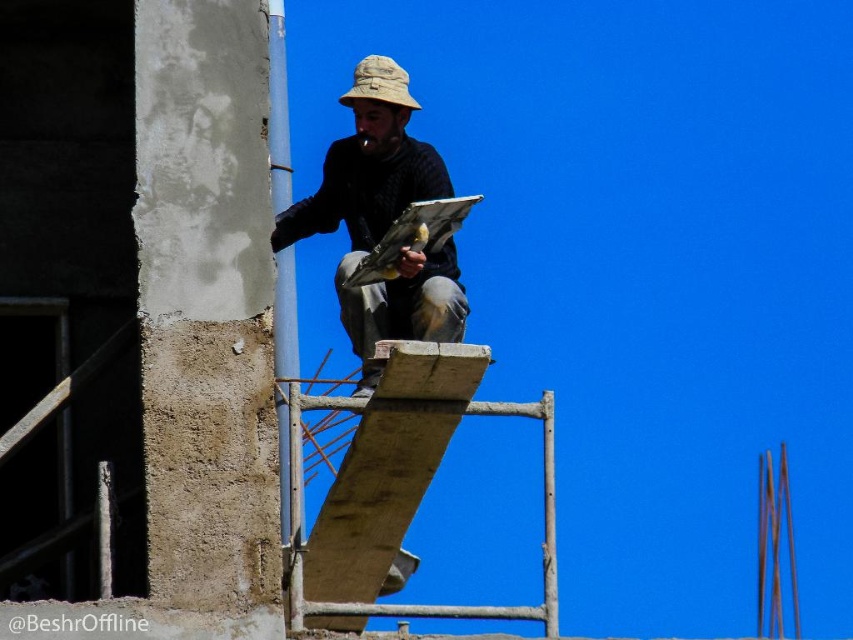
Question: In this image, where is matte black shirt at center located relative to tan fabric hat at center?

Choices:
 (A) above
 (B) below

Answer: (B)

Question: Which of the following is the closest to the observer?

Choices:
 (A) (357, 208)
 (B) (387, 96)

Answer: (B)

Question: Does matte black shirt at center have a greater width compared to tan fabric hat at center?

Choices:
 (A) yes
 (B) no

Answer: (A)

Question: Which object is closer to the camera taking this photo?

Choices:
 (A) matte black shirt at center
 (B) tan fabric hat at center

Answer: (A)

Question: Which point appears farthest from the camera in this image?

Choices:
 (A) (380, 81)
 (B) (439, 307)

Answer: (A)

Question: Is matte black shirt at center smaller than tan fabric hat at center?

Choices:
 (A) yes
 (B) no

Answer: (B)